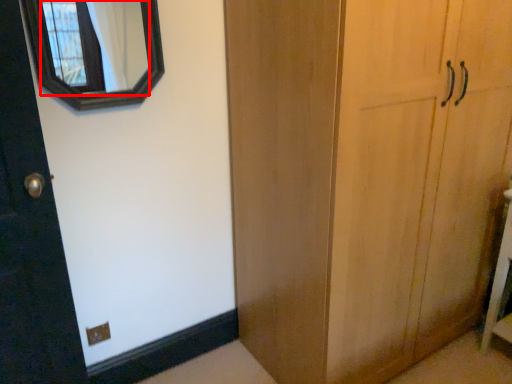
Question: Observing the image, what is the correct spatial positioning of mirror (annotated by the red box) in reference to vanity?

Choices:
 (A) left
 (B) right

Answer: (A)